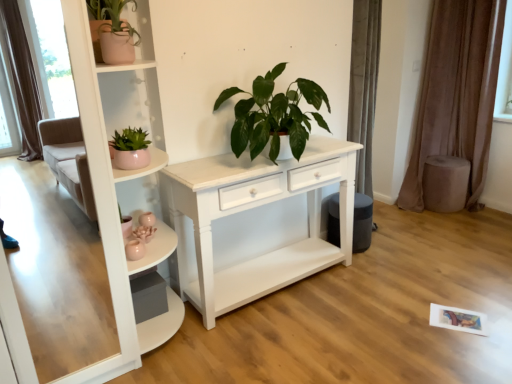
Question: Is green glossy plant at center, marked as the first houseplant in a right-to-left arrangement, aimed at brown velvet curtain at right?

Choices:
 (A) no
 (B) yes

Answer: (A)

Question: From the image's perspective, is green glossy plant at center, acting as the third houseplant starting from the left, beneath brown velvet curtain at right?

Choices:
 (A) no
 (B) yes

Answer: (B)

Question: Is green glossy plant at center, acting as the third houseplant starting from the left, positioned beyond the bounds of brown velvet curtain at right?

Choices:
 (A) yes
 (B) no

Answer: (A)

Question: Considering the relative sizes of green glossy plant at center, marked as the first houseplant in a right-to-left arrangement, and brown velvet curtain at right in the image provided, is green glossy plant at center, marked as the first houseplant in a right-to-left arrangement, bigger than brown velvet curtain at right?

Choices:
 (A) yes
 (B) no

Answer: (B)

Question: Considering the relative positions of green glossy plant at center, acting as the third houseplant starting from the left, and brown velvet curtain at right in the image provided, is green glossy plant at center, acting as the third houseplant starting from the left, in front of brown velvet curtain at right?

Choices:
 (A) yes
 (B) no

Answer: (A)

Question: Can you confirm if green glossy plant at center, acting as the third houseplant starting from the left, is shorter than brown velvet curtain at right?

Choices:
 (A) yes
 (B) no

Answer: (A)

Question: Considering the relative positions of white glossy shelf at upper left and brown velvet curtain at right in the image provided, is white glossy shelf at upper left to the left of brown velvet curtain at right from the viewer's perspective?

Choices:
 (A) yes
 (B) no

Answer: (A)

Question: From the image's perspective, is white glossy shelf at upper left beneath brown velvet curtain at right?

Choices:
 (A) no
 (B) yes

Answer: (B)

Question: Is white glossy shelf at upper left closer to the viewer compared to brown velvet curtain at right?

Choices:
 (A) yes
 (B) no

Answer: (A)

Question: Is white glossy shelf at upper left positioned beyond the bounds of brown velvet curtain at right?

Choices:
 (A) yes
 (B) no

Answer: (A)

Question: Does white glossy shelf at upper left have a greater height compared to brown velvet curtain at right?

Choices:
 (A) yes
 (B) no

Answer: (B)

Question: Can brown velvet curtain at right be found inside white glossy shelf at upper left?

Choices:
 (A) no
 (B) yes

Answer: (A)

Question: Is matte pink pot at left, the 2th houseplant viewed from the right, shorter than brown velvet curtain at right?

Choices:
 (A) no
 (B) yes

Answer: (B)